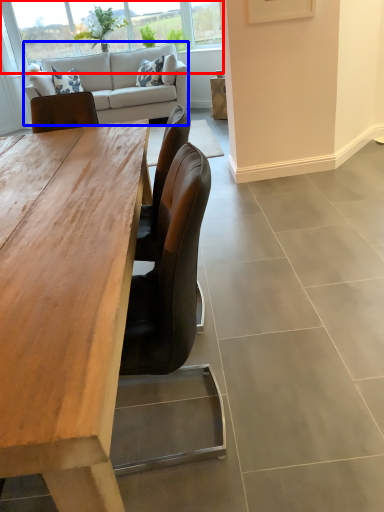
Question: Which object appears closest to the camera in this image, window (highlighted by a red box) or studio couch (highlighted by a blue box)?

Choices:
 (A) window
 (B) studio couch

Answer: (B)